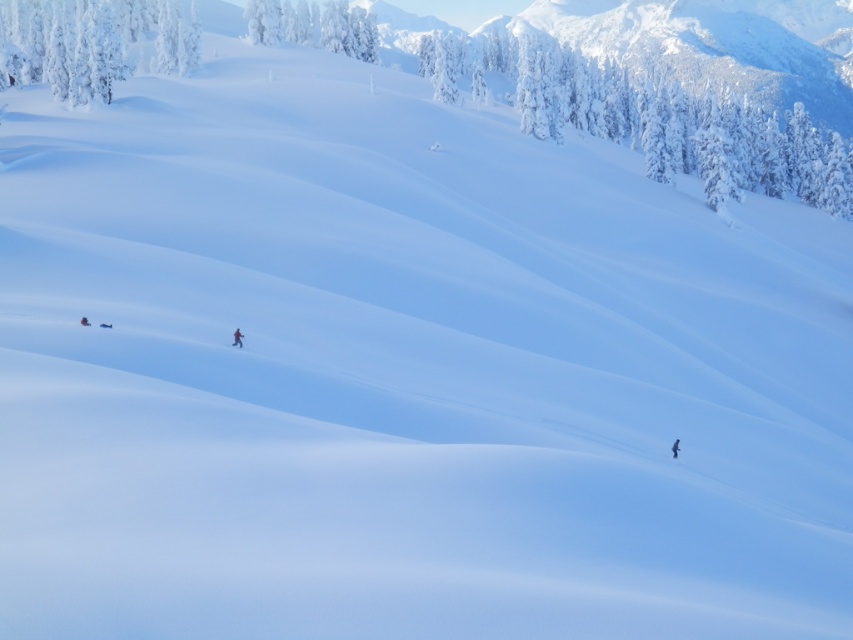
You are an observer standing at the top of a hill overlooking the snow landscape. You notice two skis on the ground below you. Which ski is closer to the bottom of the hill? The white matte ski at lower right or the shiny red ski at center?

The white matte ski at lower right is located below the shiny red ski at center, so it is closer to the bottom of the hill.

You are planning to take a photo of the white frosty tree at upper center and the shiny red ski at center in the snow landscape. Which object should you focus on first if you want to capture both in a single shot without adjusting your camera focus?

The white frosty tree at upper center is taller than the shiny red ski at center, so you should focus on the white frosty tree at upper center first to ensure both are in focus.